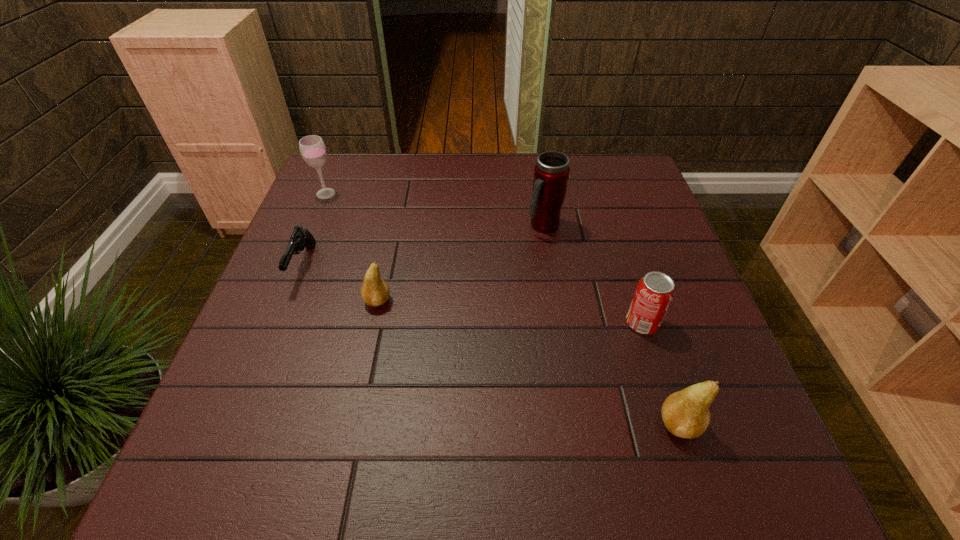
Please point a spot to place another pear for symmetrical spacing. Please provide its 2D coordinates. Your answer should be formatted as a tuple, i.e. [(x, y)], where the tuple contains the x and y coordinates of a point satisfying the conditions above.

[(511, 356)]